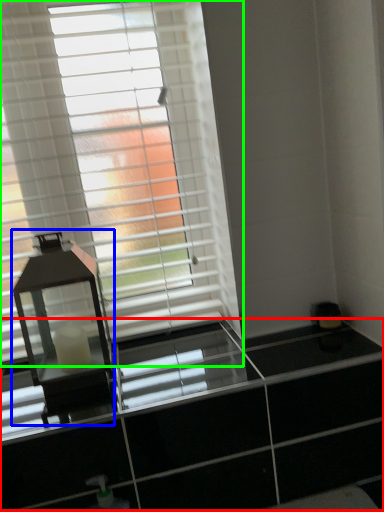
Question: Which is farther away from dresser (highlighted by a red box)? table lamp (highlighted by a blue box) or window blind (highlighted by a green box)?

Choices:
 (A) table lamp
 (B) window blind

Answer: (B)